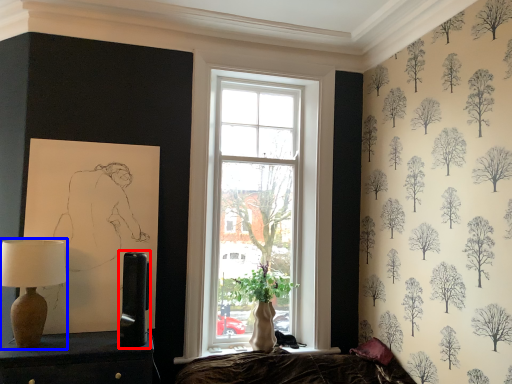
Question: Which of the following is the farthest to the observer, table lamp (highlighted by a red box) or table lamp (highlighted by a blue box)?

Choices:
 (A) table lamp
 (B) table lamp

Answer: (A)